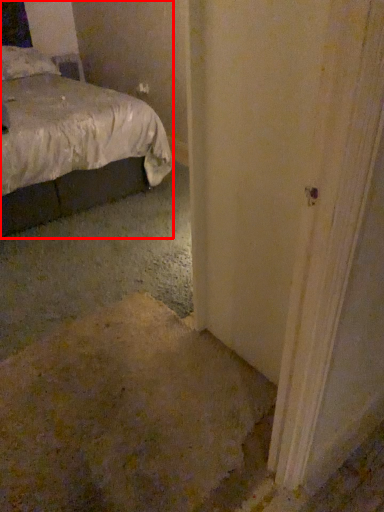
Question: From the image's perspective, what is the correct spatial positioning of bed (annotated by the red box) in reference to pillow?

Choices:
 (A) above
 (B) below

Answer: (B)